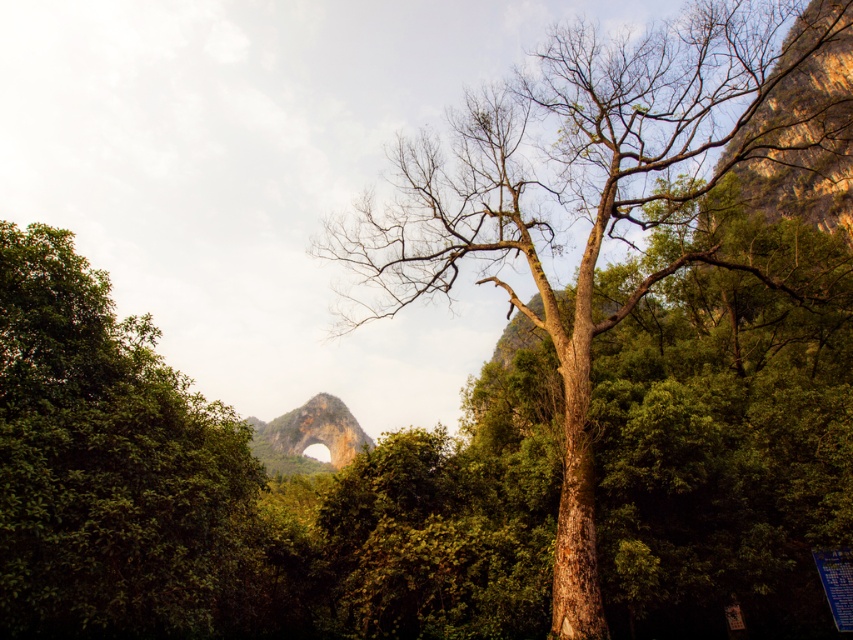
This screenshot has width=853, height=640. What do you see at coordinates (111, 467) in the screenshot?
I see `green leafy tree at left` at bounding box center [111, 467].

Based on the photo, does green leafy tree at left have a greater width compared to rustic stone arch at center?

No.

This screenshot has height=640, width=853. What do you see at coordinates (111, 467) in the screenshot?
I see `green leafy tree at left` at bounding box center [111, 467].

Find the location of a particular element. green leafy tree at left is located at coordinates click(x=111, y=467).

Is brown rough bark tree at center positioned in front of rustic stone arch at center?

Yes, brown rough bark tree at center is closer to the viewer.

Between brown rough bark tree at center and rustic stone arch at center, which one is positioned higher?

brown rough bark tree at center is above.

Is point (761, 518) positioned after point (299, 444)?

No, it is not.

Identify the location of brown rough bark tree at center. The width and height of the screenshot is (853, 640). (622, 346).

Is brown rough bark tree at center positioned behind green leafy tree at left?

Yes, brown rough bark tree at center is further from the viewer.

You are a GUI agent. You are given a task and a screenshot of the screen. Output one action in this format:
    pyautogui.click(x=<x>, y=<y>)
    Task: Click on the brown rough bark tree at center
    The image size is (853, 640).
    Given the screenshot: What is the action you would take?
    pyautogui.click(x=622, y=346)

What are the coordinates of `brown rough bark tree at center` in the screenshot? It's located at (622, 346).